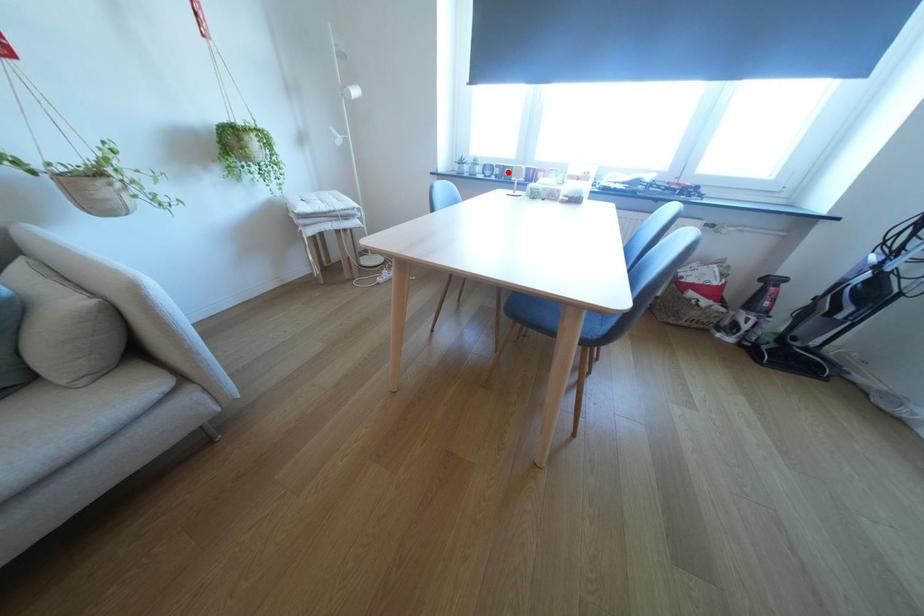
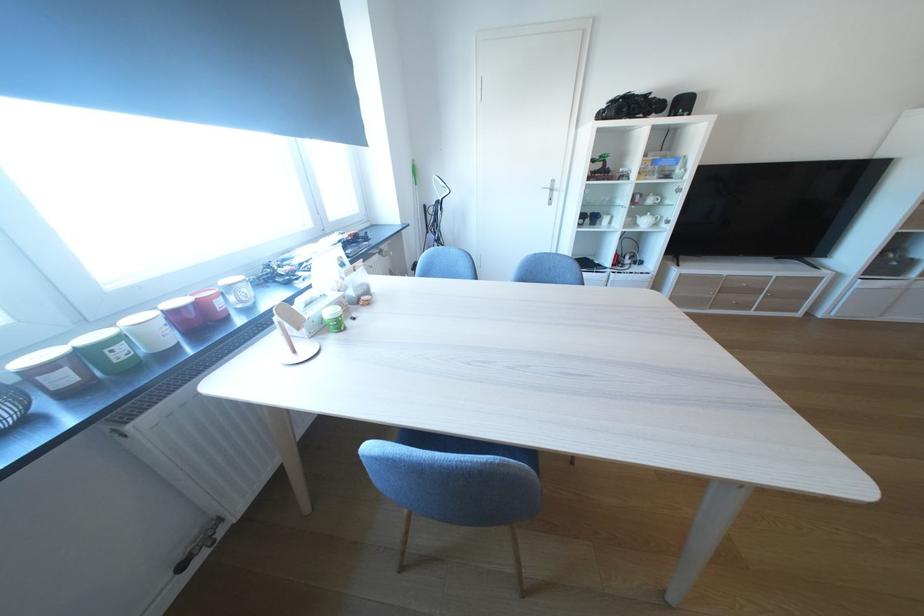
Find the pixel in the second image that matches the highlighted location in the first image.

(75, 379)